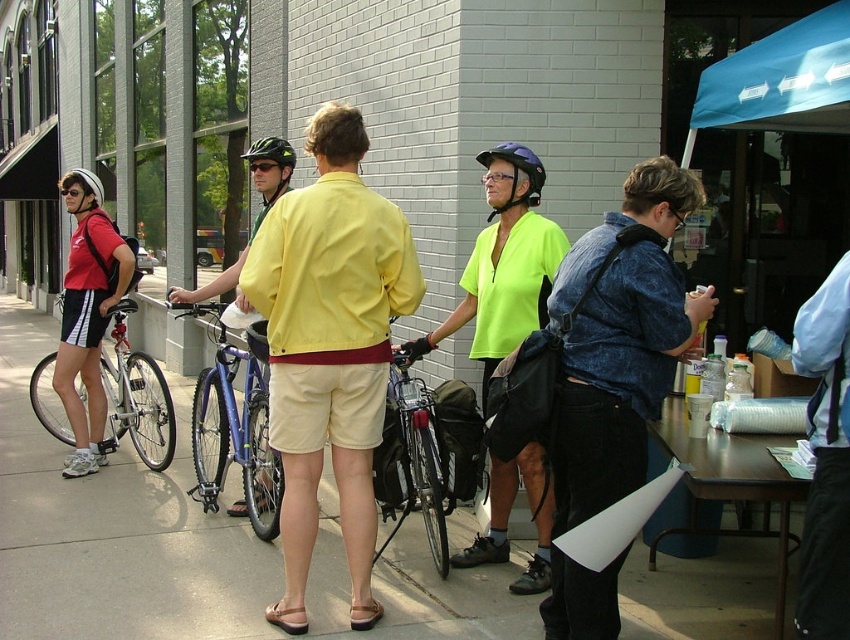
You are standing on the beige concrete sidewalk at center and want to greet the person wearing the yellow fabric shirt at center. Which direction should you move to approach them?

The beige concrete sidewalk at center is in front of the yellow fabric shirt at center, so you should move backward to approach the person wearing the yellow fabric shirt at center.

You are standing on the beige concrete sidewalk at center and looking up. Can you see the top of the yellow fabric shirt at center?

The beige concrete sidewalk at center has a lesser height compared to yellow fabric shirt at center, so yes, you can see the top of the yellow fabric shirt at center from the sidewalk.